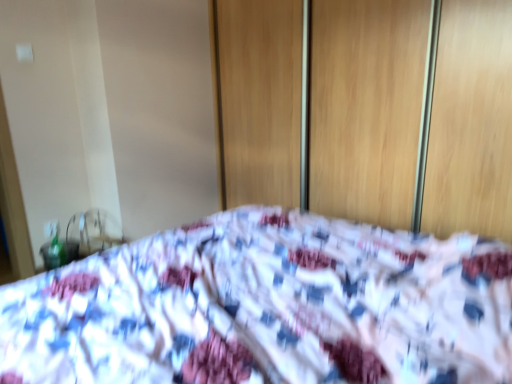
I want to click on fluffy fabric bed at center, so click(x=267, y=307).

Describe the element at coordinates (267, 307) in the screenshot. I see `fluffy fabric bed at center` at that location.

Where is `wooden screen door at center`? Image resolution: width=512 pixels, height=384 pixels. wooden screen door at center is located at coordinates (x=365, y=107).

Describe the element at coordinates (365, 107) in the screenshot. I see `wooden screen door at center` at that location.

This screenshot has width=512, height=384. What are the coordinates of `fluffy fabric bed at center` in the screenshot? It's located at (267, 307).

Is wooden screen door at center to the right of fluffy fabric bed at center from the viewer's perspective?

Correct, you'll find wooden screen door at center to the right of fluffy fabric bed at center.

Is wooden screen door at center positioned behind fluffy fabric bed at center?

That is True.

Considering the positions of points (509, 188) and (230, 287), is point (509, 188) farther from camera compared to point (230, 287)?

That is True.

From the image's perspective, between wooden screen door at center and fluffy fabric bed at center, who is located below?

fluffy fabric bed at center.

From a real-world perspective, is wooden screen door at center located beneath fluffy fabric bed at center?

No, from a real-world perspective, wooden screen door at center is not under fluffy fabric bed at center.

In terms of width, does wooden screen door at center look wider or thinner when compared to fluffy fabric bed at center?

Clearly, wooden screen door at center has less width compared to fluffy fabric bed at center.

Does wooden screen door at center have a greater height compared to fluffy fabric bed at center?

Yes.

Does wooden screen door at center have a larger size compared to fluffy fabric bed at center?

Incorrect, wooden screen door at center is not larger than fluffy fabric bed at center.

Do you think wooden screen door at center is within fluffy fabric bed at center, or outside of it?

wooden screen door at center is spatially situated outside fluffy fabric bed at center.

Is wooden screen door at center not close to fluffy fabric bed at center?

wooden screen door at center is positioned a significant distance from fluffy fabric bed at center.

Is wooden screen door at center aimed at fluffy fabric bed at center?

Yes.

Can you tell me how much wooden screen door at center and fluffy fabric bed at center differ in facing direction?

The angle between the facing direction of wooden screen door at center and the facing direction of fluffy fabric bed at center is 89.9 degrees.

Consider the image. How far apart are wooden screen door at center and fluffy fabric bed at center?

wooden screen door at center is 3.56 feet from fluffy fabric bed at center.

Locate an element on the screen. screen door on the right of fluffy fabric bed at center is located at coordinates (365, 107).

Considering the positions of objects fluffy fabric bed at center and wooden screen door at center in the image provided, who is more to the right, fluffy fabric bed at center or wooden screen door at center?

Positioned to the right is wooden screen door at center.

In the image, is fluffy fabric bed at center positioned in front of or behind wooden screen door at center?

fluffy fabric bed at center is in front of wooden screen door at center.

Considering the points (309, 259) and (380, 122), which point is behind, point (309, 259) or point (380, 122)?

The point (380, 122) is farther.

From the image's perspective, which one is positioned lower, fluffy fabric bed at center or wooden screen door at center?

fluffy fabric bed at center.

From a real-world perspective, is fluffy fabric bed at center positioned over wooden screen door at center based on gravity?

No, from a real-world perspective, fluffy fabric bed at center is not over wooden screen door at center

Which object is thinner, fluffy fabric bed at center or wooden screen door at center?

wooden screen door at center.

From their relative heights in the image, would you say fluffy fabric bed at center is taller or shorter than wooden screen door at center?

Considering their sizes, fluffy fabric bed at center has less height than wooden screen door at center.

Can you confirm if fluffy fabric bed at center is bigger than wooden screen door at center?

Yes, fluffy fabric bed at center is bigger than wooden screen door at center.

Which is correct: fluffy fabric bed at center is inside wooden screen door at center, or outside of it?

fluffy fabric bed at center is located beyond the bounds of wooden screen door at center.

Is there a large distance between fluffy fabric bed at center and wooden screen door at center?

Yes.

Could you tell me if fluffy fabric bed at center is facing wooden screen door at center?

No.

What's the angular difference between fluffy fabric bed at center and wooden screen door at center's facing directions?

The facing directions of fluffy fabric bed at center and wooden screen door at center are 89.9 degrees apart.

Locate an element on the screen. The width and height of the screenshot is (512, 384). screen door behind the fluffy fabric bed at center is located at coordinates (365, 107).

At what (x,y) coordinates should I click in order to perform the action: click on screen door on the right of fluffy fabric bed at center. Please return your answer as a coordinate pair (x, y). This screenshot has height=384, width=512. Looking at the image, I should click on (365, 107).

At what (x,y) coordinates should I click in order to perform the action: click on screen door above the fluffy fabric bed at center (from the image's perspective). Please return your answer as a coordinate pair (x, y). Looking at the image, I should click on (365, 107).